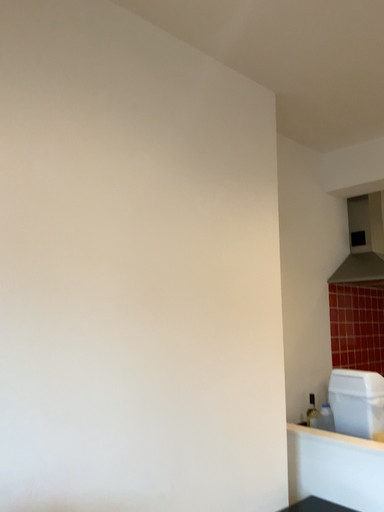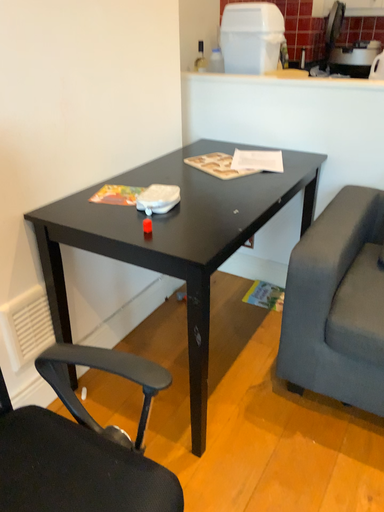
Question: How did the camera likely rotate when shooting the video?

Choices:
 (A) rotated left
 (B) rotated right

Answer: (B)